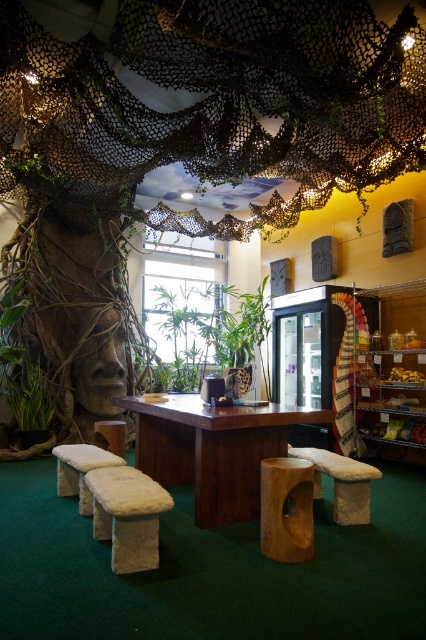
Question: Which point appears closest to the camera in this image?

Choices:
 (A) coord(143,490)
 (B) coord(373,468)
 (C) coord(63,481)
 (D) coord(158,433)

Answer: (A)

Question: Which point is closer to the camera?

Choices:
 (A) (117, 440)
 (B) (77, 460)
 (C) (143, 563)

Answer: (C)

Question: Can you confirm if wooden stool at center is wider than beige fabric stool at lower right?

Choices:
 (A) yes
 (B) no

Answer: (B)

Question: Among these points, which one is farthest from the camera?

Choices:
 (A) (123, 524)
 (B) (204, 515)

Answer: (B)

Question: Is wooden stool at center closer to camera compared to beige fabric stool at lower right?

Choices:
 (A) yes
 (B) no

Answer: (A)

Question: Is brown textured tree trunk at center further to camera compared to beige felt stool at lower left?

Choices:
 (A) yes
 (B) no

Answer: (B)